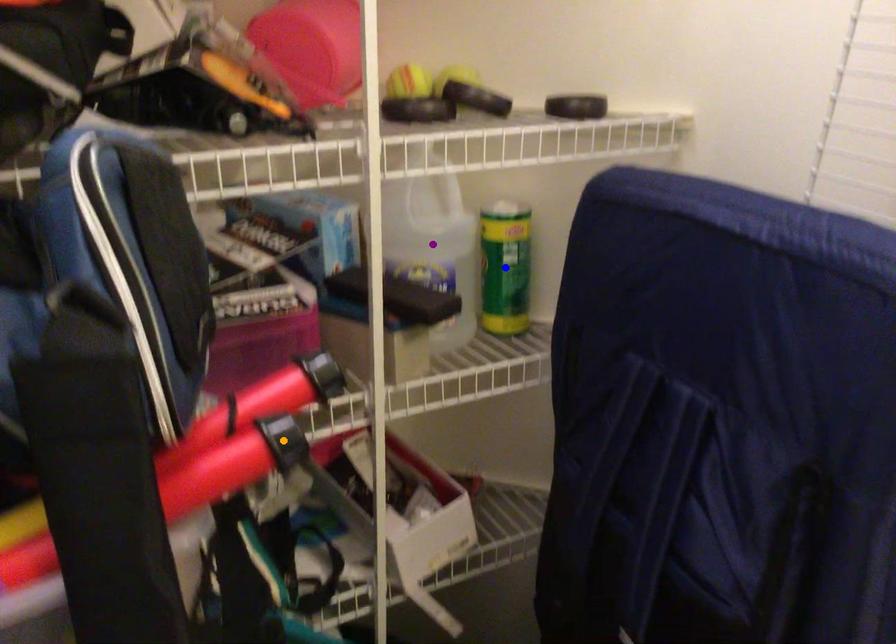
Order these from nearest to farthest:
blue point
orange point
purple point

1. orange point
2. purple point
3. blue point